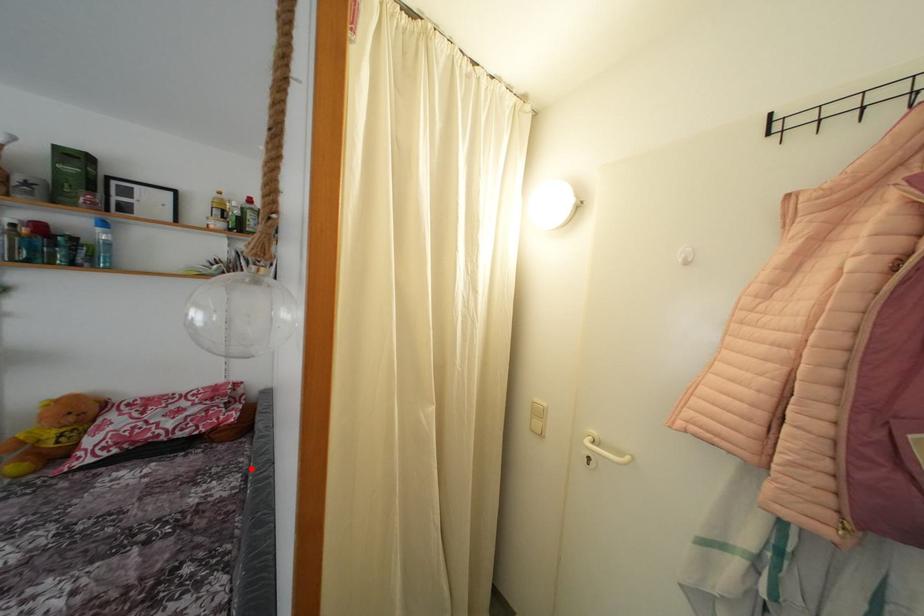
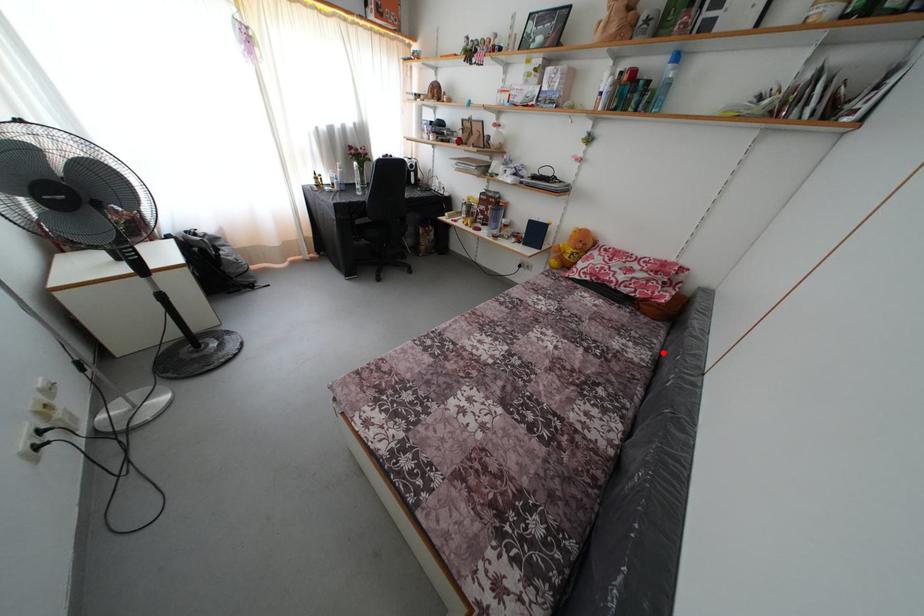
I am providing you with two images of the same scene from different viewpoints. A red point is marked on the first image and another point is marked on the second image. Are the points marked in image1 and image2 representing the same 3D position?

Yes